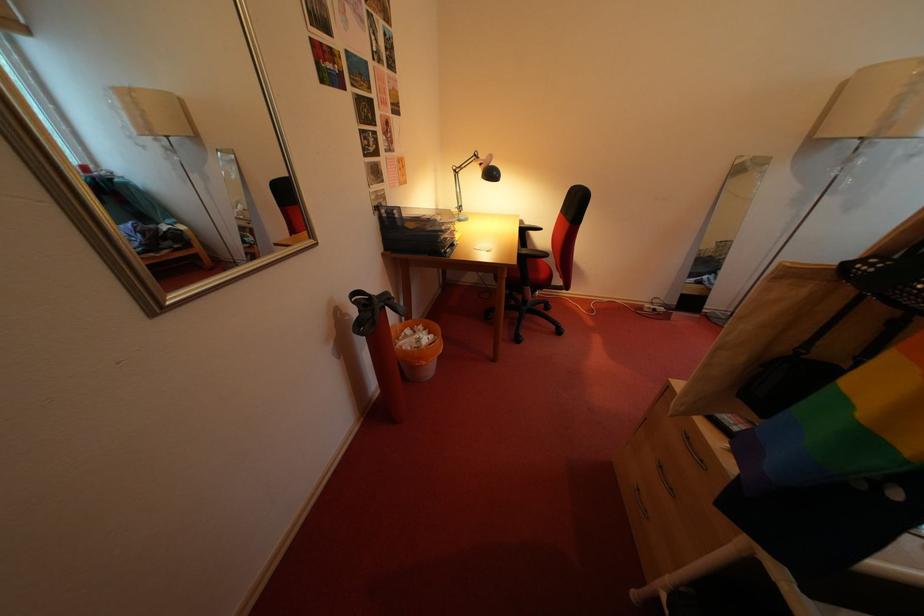
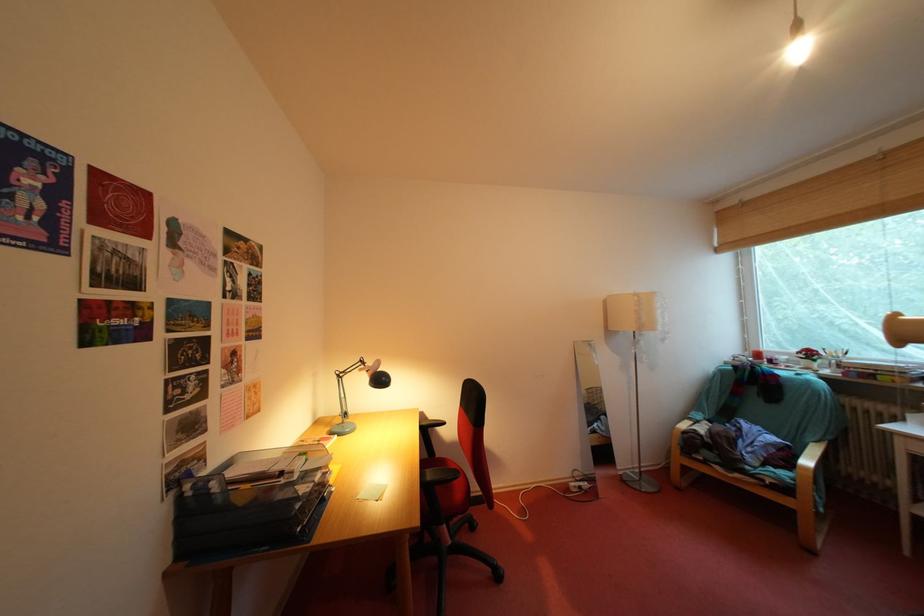
Consider the image. How did the camera likely rotate?

The camera's rotation is toward right-up.